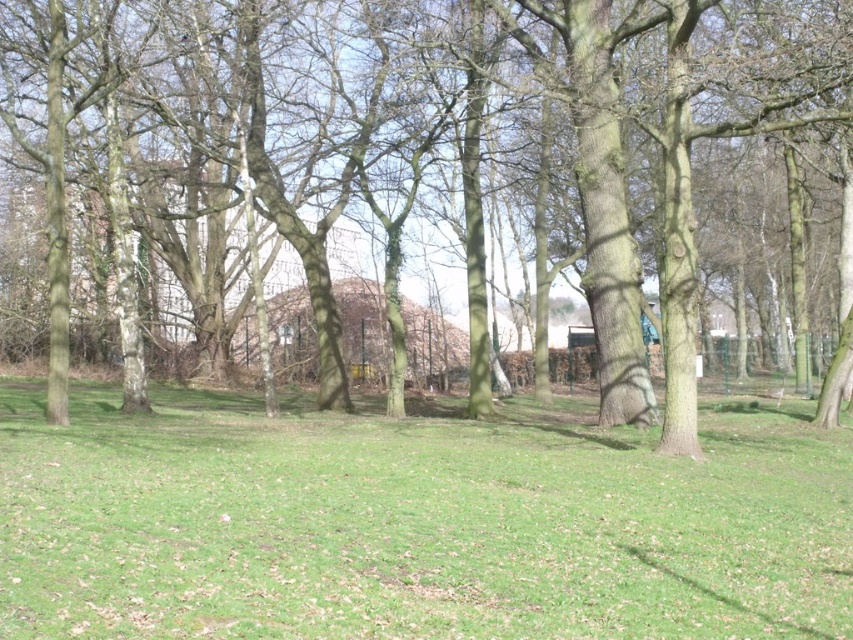
Is green grassy field at center positioned before brown rough tree at center?

Yes, green grassy field at center is closer to the viewer.

Which is above, green grassy field at center or brown rough tree at center?

Positioned higher is brown rough tree at center.

What do you see at coordinates (415, 524) in the screenshot? I see `green grassy field at center` at bounding box center [415, 524].

Where is `green grassy field at center`? The height and width of the screenshot is (640, 853). green grassy field at center is located at coordinates (415, 524).